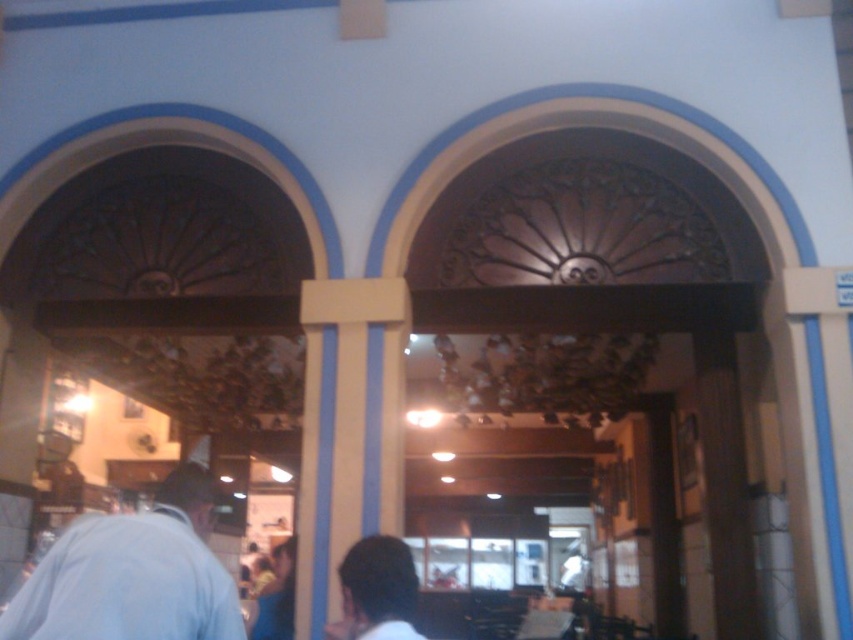
Question: Does light blue shirt at lower left appear on the right side of dark brown hair at lower center?

Choices:
 (A) no
 (B) yes

Answer: (A)

Question: Which of the following is the closest to the observer?

Choices:
 (A) dark brown hair at lower center
 (B) light blue shirt at lower left

Answer: (B)

Question: Is light blue shirt at lower left to the right of dark brown hair at lower center from the viewer's perspective?

Choices:
 (A) yes
 (B) no

Answer: (B)

Question: Does light blue shirt at lower left appear under dark brown hair at lower center?

Choices:
 (A) no
 (B) yes

Answer: (A)

Question: Which object is closer to the camera taking this photo?

Choices:
 (A) light blue shirt at lower left
 (B) dark brown hair at lower center

Answer: (A)